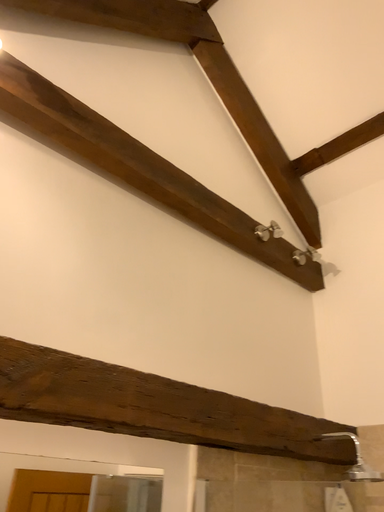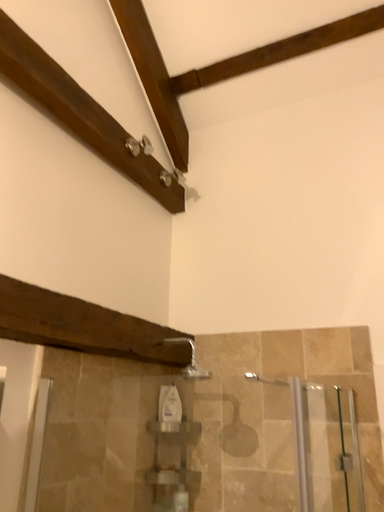
Question: How did the camera likely rotate when shooting the video?

Choices:
 (A) rotated downward
 (B) rotated upward

Answer: (A)